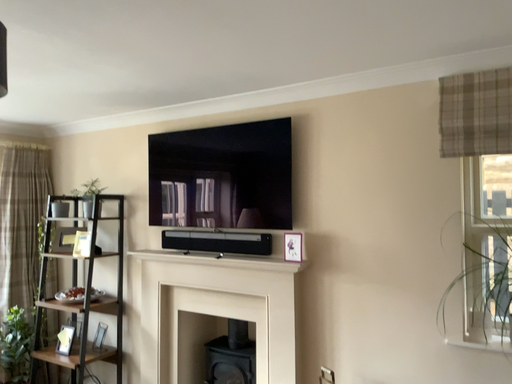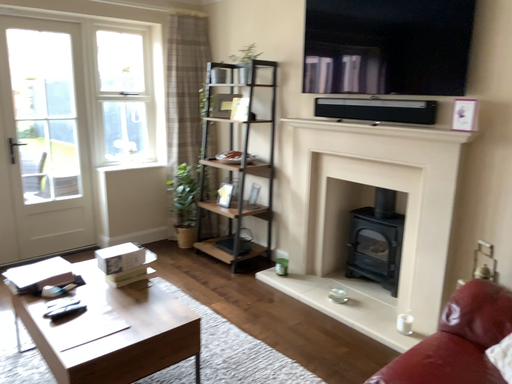
Question: How did the camera likely rotate when shooting the video?

Choices:
 (A) rotated left
 (B) rotated right

Answer: (A)